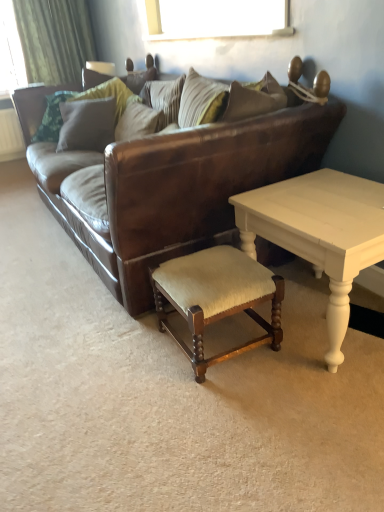
Question: Does point (190, 166) appear closer or farther from the camera than point (153, 89)?

Choices:
 (A) farther
 (B) closer

Answer: (B)

Question: Which is correct: brown leather couch at center is inside striped fabric pillow at center, positioned as the 1th pillow in right-to-left order, or outside of it?

Choices:
 (A) inside
 (B) outside

Answer: (B)

Question: Which of these objects is positioned farthest from the brown leather couch at center?

Choices:
 (A) velvet green pillow at upper center, which ranks as the 1th pillow in left-to-right order
 (B) white painted wood coffee table at right
 (C) green fabric curtain at upper left
 (D) striped fabric pillow at center, positioned as the 1th pillow in right-to-left order
 (E) wooden upholstered stool at lower center

Answer: (C)

Question: Considering the real-world distances, which object is farthest from the striped fabric pillow at center, positioned as the 1th pillow in right-to-left order?

Choices:
 (A) velvet green pillow at upper center, which ranks as the 1th pillow in left-to-right order
 (B) wooden upholstered stool at lower center
 (C) brown leather couch at center
 (D) green fabric curtain at upper left
 (E) white painted wood coffee table at right

Answer: (D)